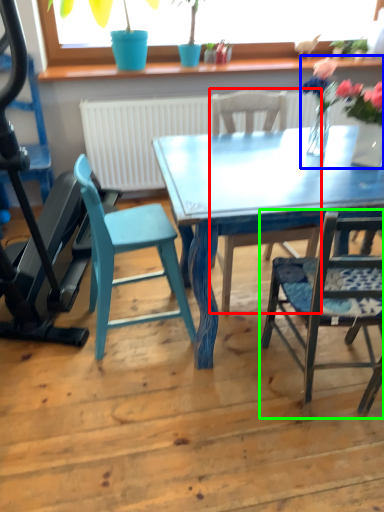
Question: Considering the real-world distances, which object is farthest from chair (highlighted by a red box)? floral arrangement (highlighted by a blue box) or chair (highlighted by a green box)?

Choices:
 (A) floral arrangement
 (B) chair

Answer: (A)